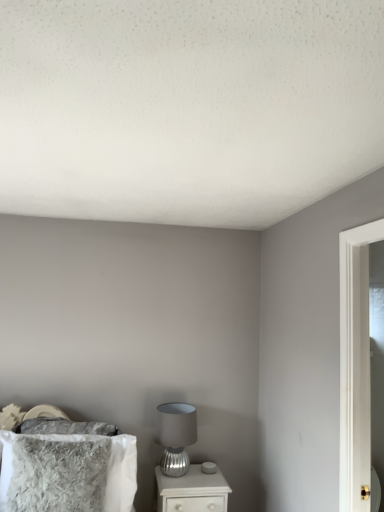
Question: Considering the relative positions of white glossy nightstand at lower center and fuzzy gray pillow at lower left in the image provided, is white glossy nightstand at lower center to the left of fuzzy gray pillow at lower left from the viewer's perspective?

Choices:
 (A) no
 (B) yes

Answer: (A)

Question: Is white glossy nightstand at lower center aimed at fuzzy gray pillow at lower left?

Choices:
 (A) no
 (B) yes

Answer: (A)

Question: Are white glossy nightstand at lower center and fuzzy gray pillow at lower left beside each other?

Choices:
 (A) yes
 (B) no

Answer: (B)

Question: Does white glossy nightstand at lower center have a lesser width compared to fuzzy gray pillow at lower left?

Choices:
 (A) yes
 (B) no

Answer: (B)

Question: Does white glossy nightstand at lower center have a lesser height compared to fuzzy gray pillow at lower left?

Choices:
 (A) yes
 (B) no

Answer: (A)

Question: Considering the positions of white glossy nightstand at lower center and satin silver table lamp at lower center in the image, is white glossy nightstand at lower center taller or shorter than satin silver table lamp at lower center?

Choices:
 (A) tall
 (B) short

Answer: (B)

Question: From a real-world perspective, is white glossy nightstand at lower center above or below satin silver table lamp at lower center?

Choices:
 (A) above
 (B) below

Answer: (B)

Question: Based on their sizes in the image, would you say white glossy nightstand at lower center is bigger or smaller than satin silver table lamp at lower center?

Choices:
 (A) small
 (B) big

Answer: (B)

Question: From the image's perspective, is white glossy nightstand at lower center located above or below satin silver table lamp at lower center?

Choices:
 (A) below
 (B) above

Answer: (A)

Question: Considering the relative positions of fuzzy gray pillow at lower left and satin silver table lamp at lower center in the image provided, is fuzzy gray pillow at lower left to the left or to the right of satin silver table lamp at lower center?

Choices:
 (A) right
 (B) left

Answer: (B)

Question: Relative to satin silver table lamp at lower center, is fuzzy gray pillow at lower left in front or behind?

Choices:
 (A) front
 (B) behind

Answer: (A)

Question: From the image's perspective, relative to satin silver table lamp at lower center, is fuzzy gray pillow at lower left above or below?

Choices:
 (A) above
 (B) below

Answer: (A)

Question: In terms of size, does fuzzy gray pillow at lower left appear bigger or smaller than satin silver table lamp at lower center?

Choices:
 (A) small
 (B) big

Answer: (B)

Question: In the image, is satin silver table lamp at lower center positioned in front of or behind fuzzy gray pillow at lower left?

Choices:
 (A) behind
 (B) front

Answer: (A)

Question: From the image's perspective, is satin silver table lamp at lower center located above or below fuzzy gray pillow at lower left?

Choices:
 (A) above
 (B) below

Answer: (B)